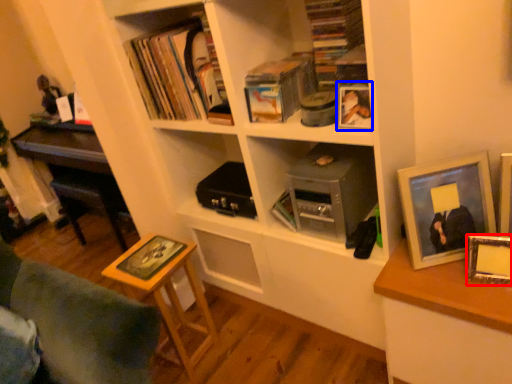
Question: Which object is closer to the camera taking this photo, picture frame (highlighted by a red box) or picture frame (highlighted by a blue box)?

Choices:
 (A) picture frame
 (B) picture frame

Answer: (A)